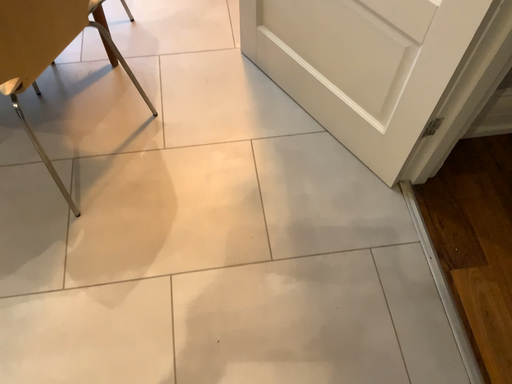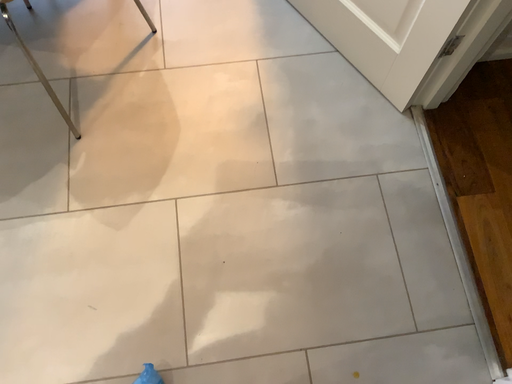
Question: How did the camera likely rotate when shooting the video?

Choices:
 (A) rotated downward
 (B) rotated upward

Answer: (A)